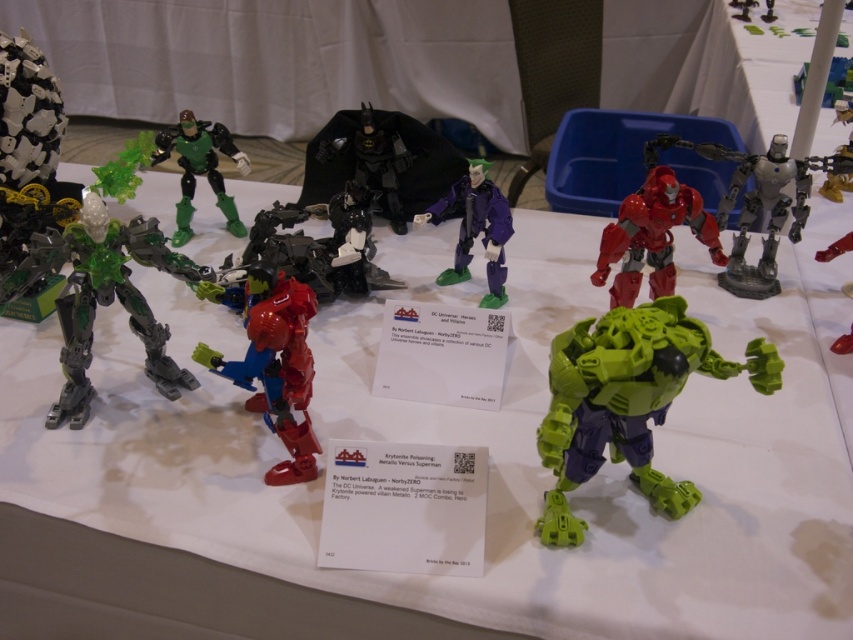
You are a collector standing 1 meter away from the table displaying the LEGO figures. You want to pick up the green matte hulk at center without moving any other figures. Can you reach it from your current position?

The green matte hulk at center is 86.24 centimeters away from the viewer. Since you are standing 1 meter away, which is approximately 100 centimeters, you can comfortably reach it without needing to move closer or disturb the other figures.

You are a collector who wants to display these two LEGO figures side by side on a shelf that is 20 inches wide. Based on the image, will the green matte hulk at center and the shiny red robot at center fit together on the shelf without overlapping?

The green matte hulk at center and shiny red robot at center are 17.40 inches apart, so they can fit on a 20 inch shelf since the total space needed is less than the shelf width.